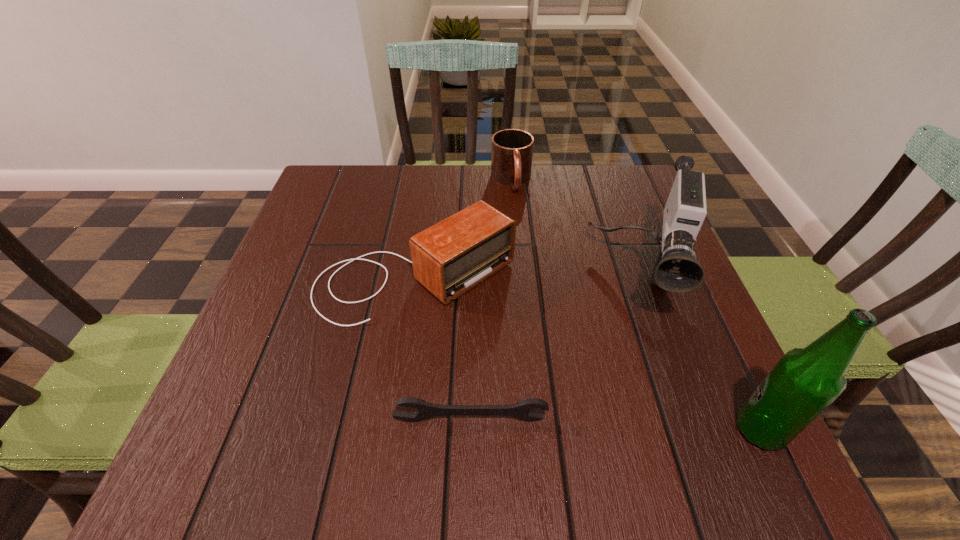
Find the location of a particular element. wrench is located at coordinates (522, 409).

Locate an element on the screen. The height and width of the screenshot is (540, 960). beer bottle is located at coordinates (805, 381).

This screenshot has width=960, height=540. I want to click on the second tallest object, so click(676, 270).

Locate an element on the screen. The image size is (960, 540). the farthest object is located at coordinates (512, 149).

The height and width of the screenshot is (540, 960). What are the coordinates of `radio receiver` in the screenshot? It's located at (x=449, y=258).

Find the location of a particular element. vacant space located 0.080m on the recording direction of the camcorder is located at coordinates (640, 367).

Locate an element on the screen. This screenshot has width=960, height=540. vacant space located on the recording direction of the camcorder is located at coordinates click(x=638, y=386).

At what (x,y) coordinates should I click in order to perform the action: click on blank space located on the recording direction of the camcorder. Please return your answer as a coordinate pair (x, y). Image resolution: width=960 pixels, height=540 pixels. Looking at the image, I should click on (639, 372).

Locate an element on the screen. Image resolution: width=960 pixels, height=540 pixels. vacant space located 0.170m on the side of the mug with the handle is located at coordinates (526, 240).

Where is `free region located on the side of the mug with the handle`? The width and height of the screenshot is (960, 540). free region located on the side of the mug with the handle is located at coordinates (522, 227).